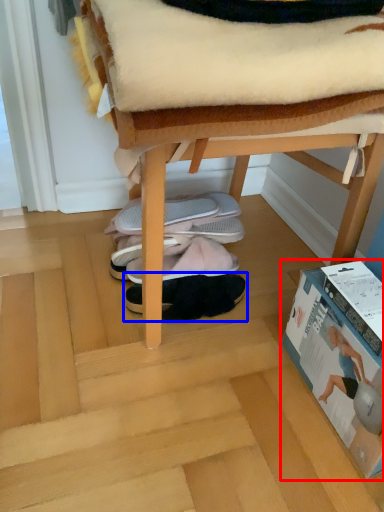
Question: Which object appears farthest to the camera in this image, paperback book (highlighted by a red box) or footwear (highlighted by a blue box)?

Choices:
 (A) paperback book
 (B) footwear

Answer: (B)